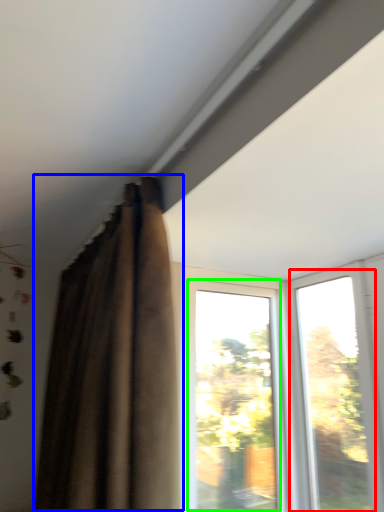
Question: Which object is positioned closest to window (highlighted by a red box)? Select from curtain (highlighted by a blue box) and window (highlighted by a green box).

Choices:
 (A) curtain
 (B) window

Answer: (B)